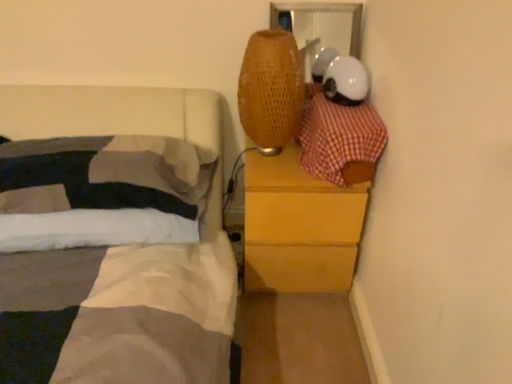
Image resolution: width=512 pixels, height=384 pixels. I want to click on empty space that is ontop of red checkered fabric at upper right, so click(345, 109).